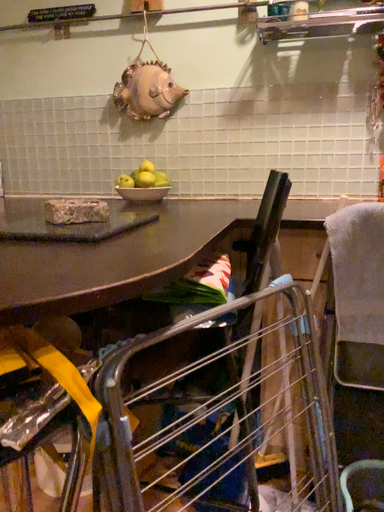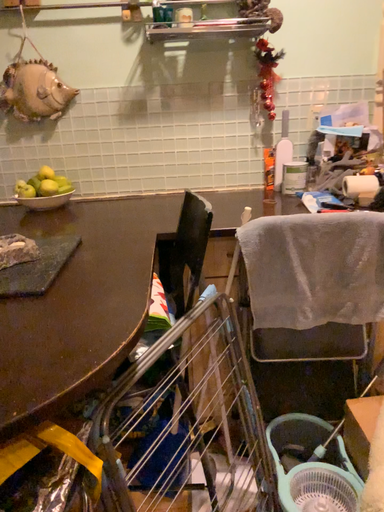
Question: How did the camera likely rotate when shooting the video?

Choices:
 (A) rotated right
 (B) rotated left

Answer: (A)